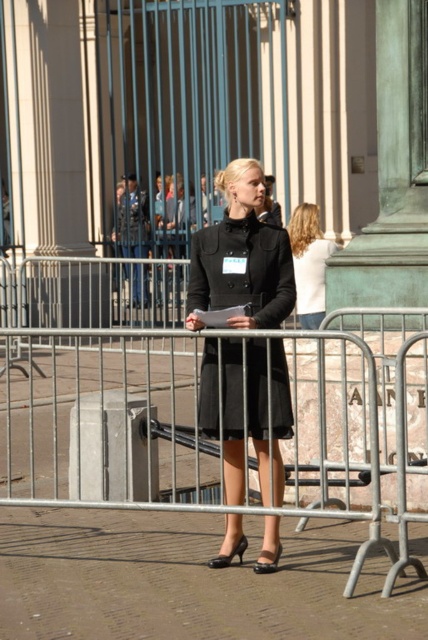
Question: Can you confirm if metallic silver fence at center is positioned to the left of matte black coat at center?

Choices:
 (A) no
 (B) yes

Answer: (B)

Question: Among these points, which one is nearest to the camera?

Choices:
 (A) (311, 259)
 (B) (267, 228)

Answer: (B)

Question: Can you confirm if metallic silver fence at center is bigger than black woolen coat at center?

Choices:
 (A) yes
 (B) no

Answer: (A)

Question: Which object is closer to the camera taking this photo?

Choices:
 (A) matte black coat at center
 (B) metallic silver fence at center
 (C) black woolen coat at center

Answer: (B)

Question: Does metallic silver fence at center appear on the left side of black woolen coat at center?

Choices:
 (A) no
 (B) yes

Answer: (B)

Question: Which object appears farthest from the camera in this image?

Choices:
 (A) matte black coat at center
 (B) metallic silver fence at center

Answer: (A)